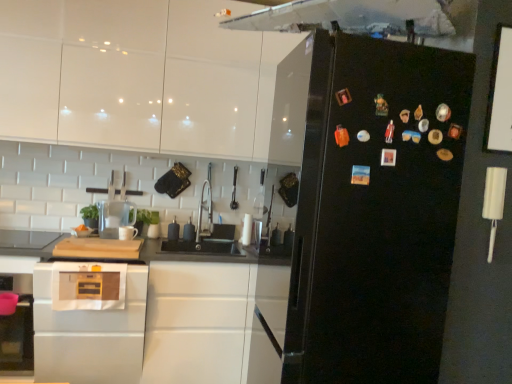
Question: From a real-world perspective, is white glossy cabinets at upper center, marked as the second cabinetry in a bottom-to-top arrangement, physically located above or below black glossy refrigerator at right?

Choices:
 (A) below
 (B) above

Answer: (B)

Question: Visually, is white glossy cabinets at upper center, marked as the second cabinetry in a bottom-to-top arrangement, positioned to the left or to the right of black glossy refrigerator at right?

Choices:
 (A) right
 (B) left

Answer: (B)

Question: Which object is positioned closest to the white glossy cabinet at lower left, placed as the 1th cabinetry when sorted from bottom to top?

Choices:
 (A) white glossy cabinets at upper center, which ranks as the 1th cabinetry in top-to-bottom order
 (B) transparent glass pitcher at center
 (C) black glossy refrigerator at right
 (D) satin silver oven at lower left

Answer: (D)

Question: Estimate the real-world distances between objects in this image. Which object is closer to the white glossy cabinets at upper center, marked as the second cabinetry in a bottom-to-top arrangement?

Choices:
 (A) satin silver oven at lower left
 (B) black glossy refrigerator at right
 (C) transparent glass pitcher at center
 (D) white glossy cabinet at lower left, placed as the 1th cabinetry when sorted from bottom to top

Answer: (C)